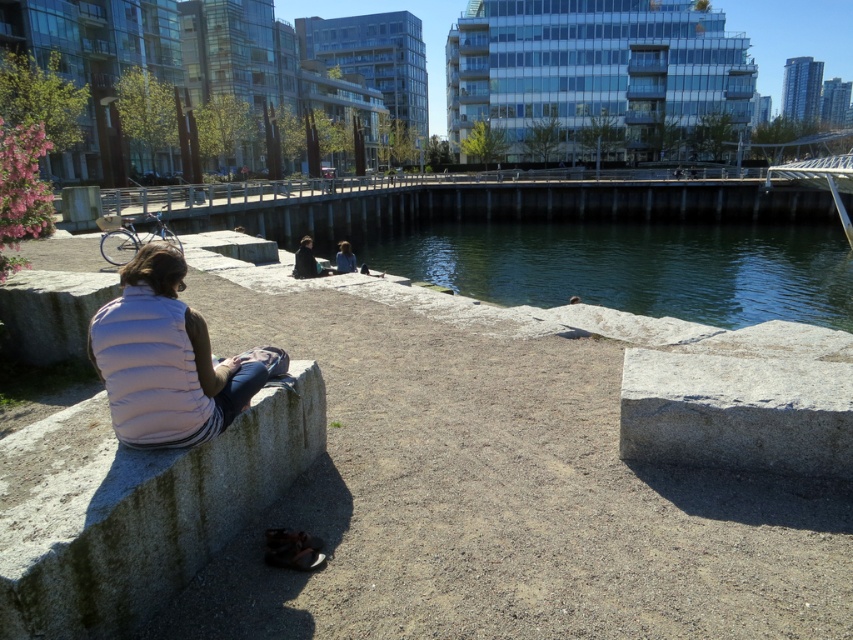
From the picture: You are standing at the edge of the scene and want to pick up an item from the gray granite concrete at lower left and the dark brown leather jacket at center. Which item can you reach without moving closer?

The gray granite concrete at lower left is closer to the viewer than the dark brown leather jacket at center, so you can reach the gray granite concrete at lower left without moving closer.

You are a photographer trying to capture the white puffy vest at left in your shot. The camera you are using has a rectangular viewfinder with coordinates from 0 to 1 on both axes. If the vest is at position 0.562 on the x and 0.192 on the y, will it be inside the viewfinder?

The white puffy vest at left is located at point [163,358]. Since the viewfinder covers coordinates from 0 to 1 on both axes, the vest is within the viewfinder as its coordinates fall within the 0 to 1 range.

You are a photographer trying to capture the white puffy vest at left and the gray granite concrete at lower left in the same frame. Which object should you focus on first if you want to ensure both are in focus without adjusting your camera settings?

The gray granite concrete at lower left is much taller than the white puffy vest at left, so focusing on the taller object first will help ensure both are in focus.